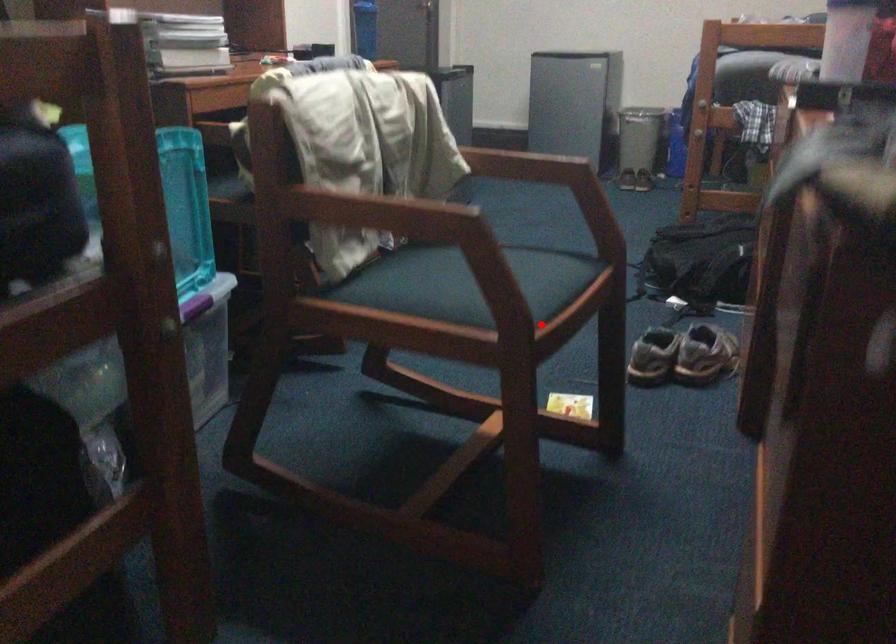
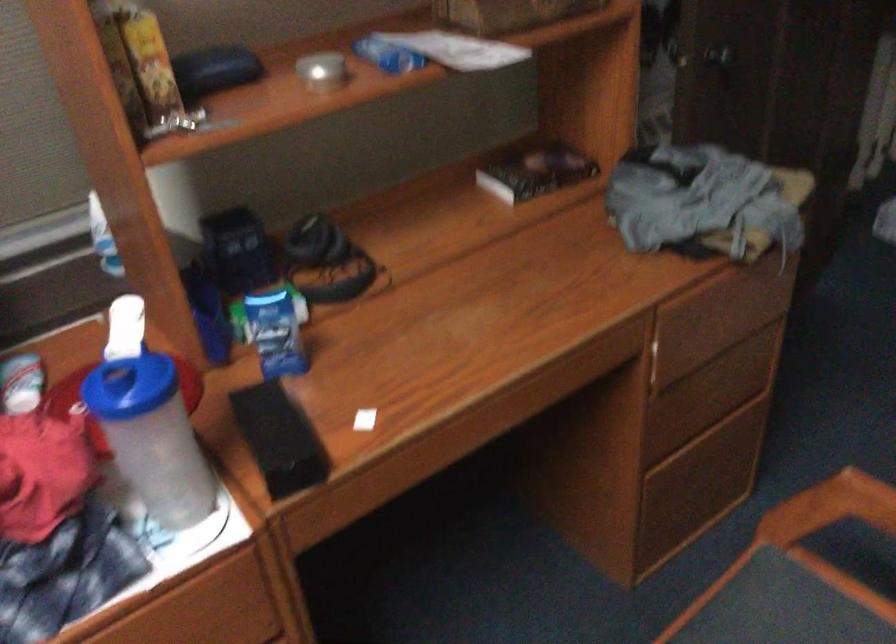
Where in the second image is the point corresponding to the highlighted location from the first image?

(780, 614)